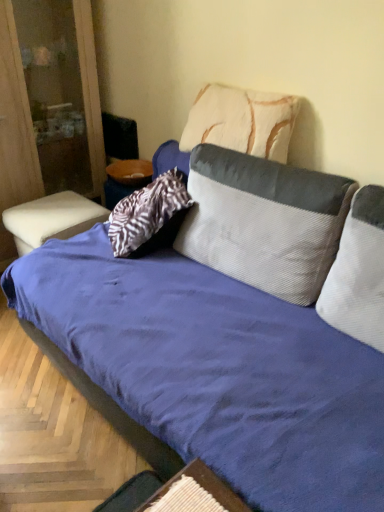
Question: Considering the relative sizes of wooden textured table at lower center, the 1th table when ordered from front to back, and white leather ottoman at left in the image provided, is wooden textured table at lower center, the 1th table when ordered from front to back, wider than white leather ottoman at left?

Choices:
 (A) yes
 (B) no

Answer: (B)

Question: From the image's perspective, is wooden textured table at lower center, the 1th table when ordered from front to back, beneath white leather ottoman at left?

Choices:
 (A) yes
 (B) no

Answer: (A)

Question: Is white leather ottoman at left a part of wooden textured table at lower center, the 1th table from the bottom?

Choices:
 (A) no
 (B) yes

Answer: (A)

Question: Can you confirm if wooden textured table at lower center, the 1th table from the bottom, is thinner than white leather ottoman at left?

Choices:
 (A) yes
 (B) no

Answer: (A)

Question: From the image's perspective, would you say wooden textured table at lower center, the 1th table from the bottom, is positioned over white leather ottoman at left?

Choices:
 (A) no
 (B) yes

Answer: (A)

Question: Does wooden textured table at lower center, the first table when ordered from right to left, have a greater height compared to white leather ottoman at left?

Choices:
 (A) yes
 (B) no

Answer: (B)

Question: Is wooden textured table at lower center, the 1th table from the bottom, shorter than blue corduroy couch at center?

Choices:
 (A) yes
 (B) no

Answer: (A)

Question: Is wooden textured table at lower center, the first table when ordered from right to left, in front of blue corduroy couch at center?

Choices:
 (A) no
 (B) yes

Answer: (B)

Question: Would you say blue corduroy couch at center is part of wooden textured table at lower center, arranged as the 2th table when viewed from the back,'s contents?

Choices:
 (A) yes
 (B) no

Answer: (B)

Question: Is wooden textured table at lower center, arranged as the 2th table when viewed from the back, placed right next to blue corduroy couch at center?

Choices:
 (A) no
 (B) yes

Answer: (A)

Question: Considering the relative sizes of wooden textured table at lower center, arranged as the 2th table when viewed from the back, and blue corduroy couch at center in the image provided, is wooden textured table at lower center, arranged as the 2th table when viewed from the back, taller than blue corduroy couch at center?

Choices:
 (A) yes
 (B) no

Answer: (B)

Question: Is wooden textured table at lower center, the 1th table from the bottom, wider than blue corduroy couch at center?

Choices:
 (A) yes
 (B) no

Answer: (B)

Question: Are white textured pillow at upper center, positioned as the 1th pillow in top-to-bottom order, and wooden textured table at lower center, the 1th table when ordered from front to back, far apart?

Choices:
 (A) yes
 (B) no

Answer: (A)